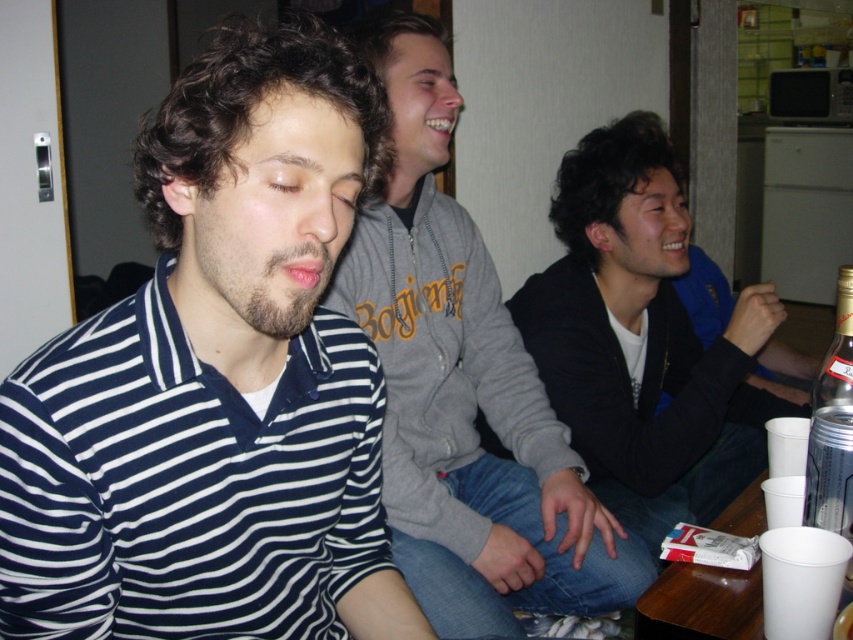
Is point (329, 525) positioned after point (842, 381)?

No.

Between point (350, 122) and point (836, 307), which one is positioned in front?

Point (350, 122) is in front.

This screenshot has width=853, height=640. What do you see at coordinates (218, 381) in the screenshot?
I see `striped cotton shirt at center` at bounding box center [218, 381].

I want to click on striped cotton shirt at center, so (218, 381).

Looking at this image, between striped cotton shirt at center and gray fleece sweatshirt at center, which one appears on the right side from the viewer's perspective?

gray fleece sweatshirt at center is more to the right.

Is striped cotton shirt at center closer to the viewer compared to gray fleece sweatshirt at center?

That is True.

Identify the location of striped cotton shirt at center. The height and width of the screenshot is (640, 853). (218, 381).

You are a GUI agent. You are given a task and a screenshot of the screen. Output one action in this format:
    pyautogui.click(x=<x>, y=<y>)
    Task: Click on the gray fleece sweatshirt at center
    This screenshot has height=640, width=853.
    Given the screenshot: What is the action you would take?
    pyautogui.click(x=463, y=387)

Can you confirm if gray fleece sweatshirt at center is wider than black matte jacket at center?

No.

Which is in front, point (422, 326) or point (718, 436)?

Point (422, 326) is more forward.

Locate an element on the screen. The width and height of the screenshot is (853, 640). gray fleece sweatshirt at center is located at coordinates (463, 387).